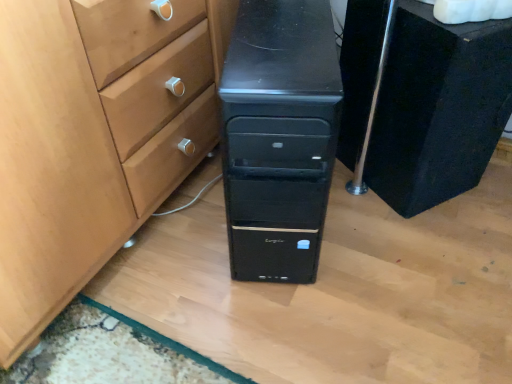
You are a GUI agent. You are given a task and a screenshot of the screen. Output one action in this format:
    pyautogui.click(x=<x>, y=<y>)
    Task: Click on the vacant area that is situated to the right of black matte chest of drawers at center, which appears as the second chest of drawers when viewed from the right
    
    Given the screenshot: What is the action you would take?
    pyautogui.click(x=413, y=235)